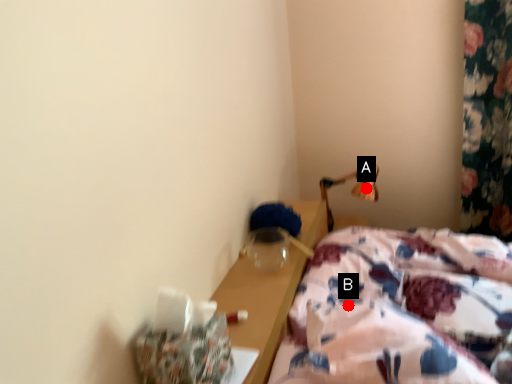
Question: Two points are circled on the image, labeled by A and B beside each circle. Among these points, which one is farthest from the camera?

Choices:
 (A) A is further
 (B) B is further

Answer: (A)